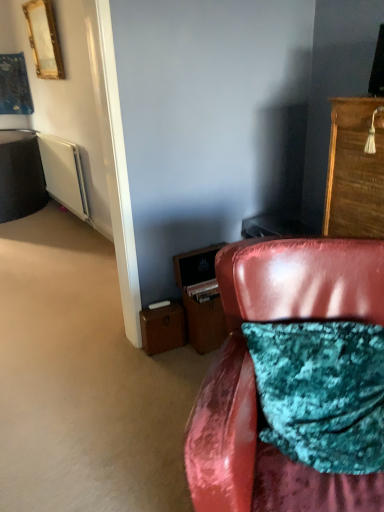
Locate an element on the screen. vacant space that is in between brown leather file cabinet at lower center and brown leather suitcase at lower left, acting as the 2th drawer starting from the right is located at coordinates (175, 355).